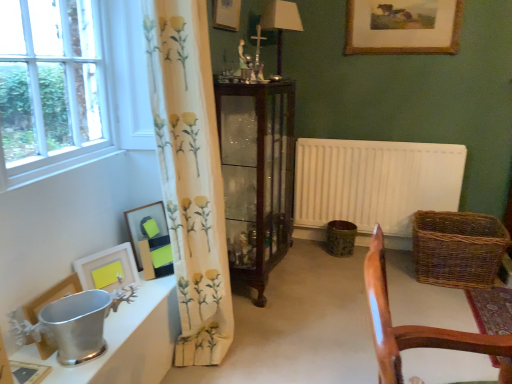
Question: Is white matte radiator at center right oriented towards polished silver bucket at lower left?

Choices:
 (A) no
 (B) yes

Answer: (B)

Question: Does white matte radiator at center right come in front of polished silver bucket at lower left?

Choices:
 (A) no
 (B) yes

Answer: (A)

Question: Is white matte radiator at center right outside polished silver bucket at lower left?

Choices:
 (A) yes
 (B) no

Answer: (A)

Question: Does white matte radiator at center right have a lesser width compared to polished silver bucket at lower left?

Choices:
 (A) no
 (B) yes

Answer: (B)

Question: Is white matte radiator at center right looking in the opposite direction of polished silver bucket at lower left?

Choices:
 (A) no
 (B) yes

Answer: (A)

Question: Is white matte radiator at center right at the left side of polished silver bucket at lower left?

Choices:
 (A) yes
 (B) no

Answer: (B)

Question: Is gold-framed painting at upper center, which is counted as the first picture frame, starting from the top, wider than white matte picture frame at lower left, the 4th picture frame in the right-to-left sequence?

Choices:
 (A) no
 (B) yes

Answer: (A)

Question: Considering the relative sizes of gold-framed painting at upper center, which is counted as the first picture frame, starting from the top, and white matte picture frame at lower left, which is the fourth picture frame from top to bottom, in the image provided, is gold-framed painting at upper center, which is counted as the first picture frame, starting from the top, bigger than white matte picture frame at lower left, which is the fourth picture frame from top to bottom,?

Choices:
 (A) no
 (B) yes

Answer: (B)

Question: From a real-world perspective, is gold-framed painting at upper center, which is the sixth picture frame from front to back, on white matte picture frame at lower left, the 4th picture frame in the right-to-left sequence?

Choices:
 (A) yes
 (B) no

Answer: (A)

Question: Does gold-framed painting at upper center, which is counted as the 6th picture frame, starting from the bottom, come behind white matte picture frame at lower left, the third picture frame when ordered from left to right?

Choices:
 (A) no
 (B) yes

Answer: (B)

Question: Is gold-framed painting at upper center, placed as the 1th picture frame when sorted from right to left, to the left of white matte picture frame at lower left, the third picture frame when ordered from left to right, from the viewer's perspective?

Choices:
 (A) yes
 (B) no

Answer: (B)

Question: Is white matte picture frame at lower left, the third picture frame when ordered from left to right, at the back of gold-framed painting at upper center, placed as the 1th picture frame when sorted from right to left?

Choices:
 (A) yes
 (B) no

Answer: (B)

Question: Is white matte picture frame at lower left, the third picture frame when ordered from left to right, oriented towards wooden chair at lower right?

Choices:
 (A) no
 (B) yes

Answer: (B)